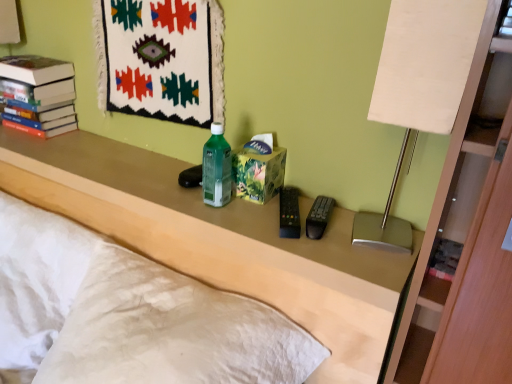
Question: In the image, is matte plastic remote control at center positioned in front of or behind white textured pillow at lower left?

Choices:
 (A) front
 (B) behind

Answer: (A)

Question: From a real-world perspective, is matte plastic remote control at center above or below white textured pillow at lower left?

Choices:
 (A) above
 (B) below

Answer: (A)

Question: Based on their relative distances, which object is farther from the matte beige table lamp at right?

Choices:
 (A) white textured pillow at lower left
 (B) matte plastic remote control at center
 (C) hardcover books at upper left

Answer: (C)

Question: Estimate the real-world distances between objects in this image. Which object is closer to the hardcover books at upper left?

Choices:
 (A) matte beige table lamp at right
 (B) matte plastic remote control at center
 (C) white textured pillow at lower left

Answer: (B)